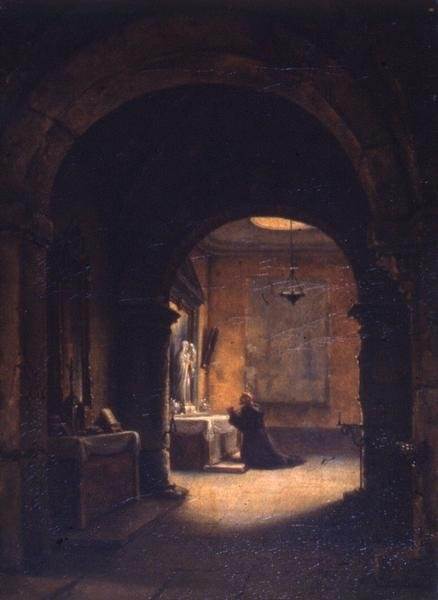
This screenshot has width=438, height=600. Identify the location of floor. (274, 496).